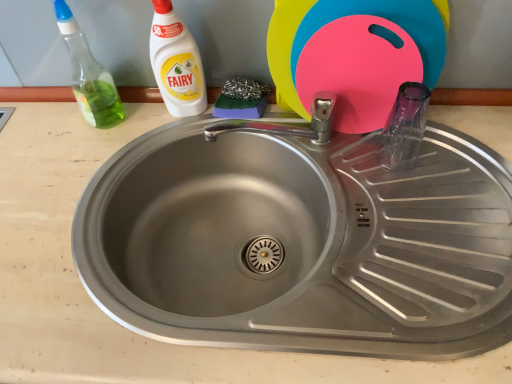
You are a GUI agent. You are given a task and a screenshot of the screen. Output one action in this format:
    pyautogui.click(x=<x>, y=<y>)
    Task: Click on the free space in front of transparent glass bottle at right
    Image resolution: width=512 pixels, height=384 pixels.
    Given the screenshot: What is the action you would take?
    pyautogui.click(x=423, y=221)